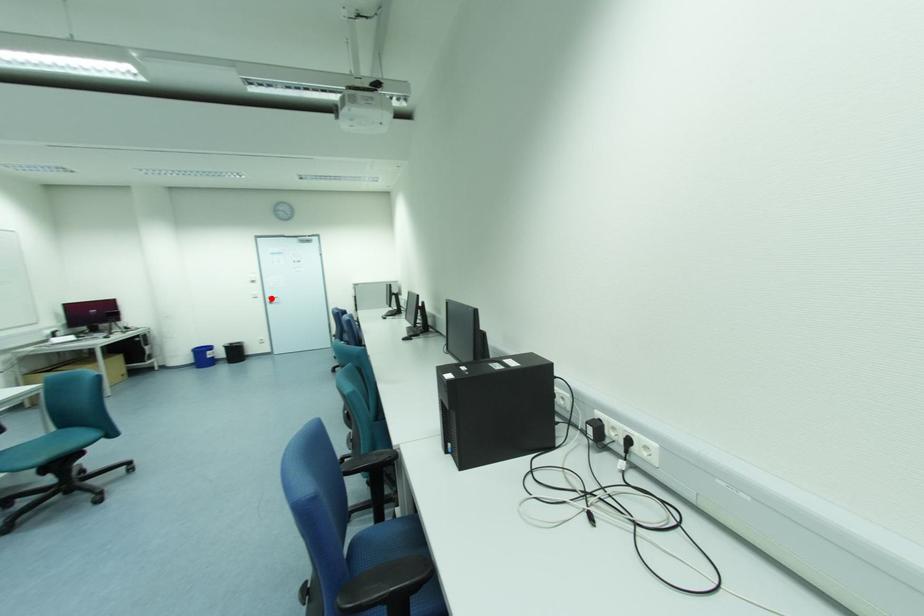
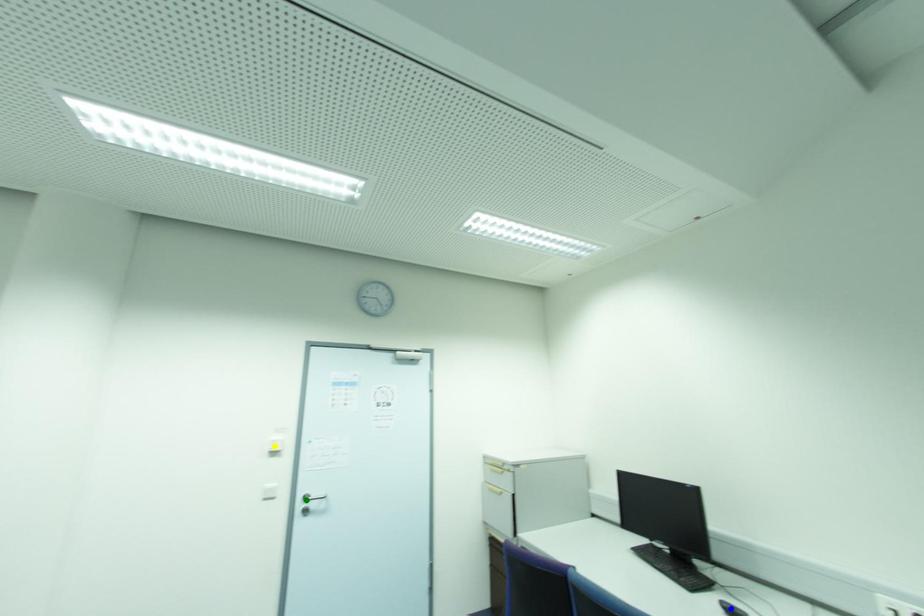
Question: I am providing you with two images of the same scene from different viewpoints. A red point is marked on the first image. You are given multiple points on the second image. Can you choose the point in image 2 that corresponds to the point in image 1?

Choices:
 (A) yellow point
 (B) green point
 (C) blue point

Answer: (B)